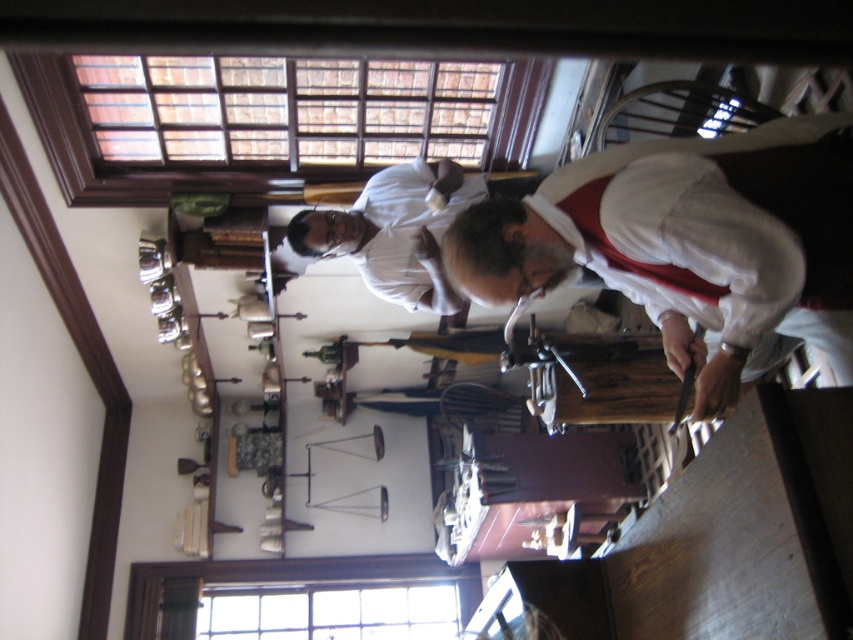
Question: Observing the image, what is the correct spatial positioning of white matte shirt at center in reference to white matte shirt at upper center?

Choices:
 (A) left
 (B) right

Answer: (B)

Question: Is white matte shirt at center positioned in front of white matte shirt at upper center?

Choices:
 (A) no
 (B) yes

Answer: (B)

Question: Which point appears closest to the camera in this image?

Choices:
 (A) (405, 275)
 (B) (733, 378)

Answer: (B)

Question: Does white matte shirt at center appear under white matte shirt at upper center?

Choices:
 (A) no
 (B) yes

Answer: (B)